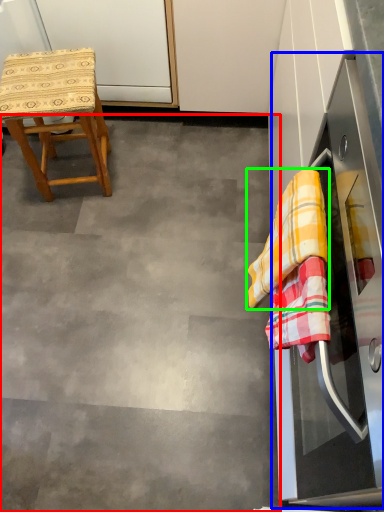
Question: Estimate the real-world distances between objects in this image. Which object is farther from concrete (highlighted by a red box), oven (highlighted by a blue box) or clothe (highlighted by a green box)?

Choices:
 (A) oven
 (B) clothe

Answer: (B)